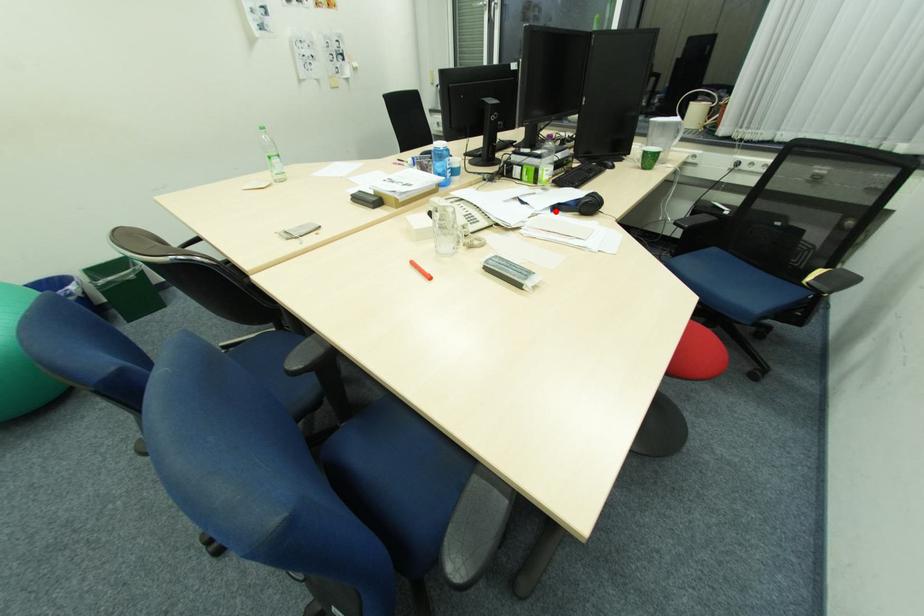
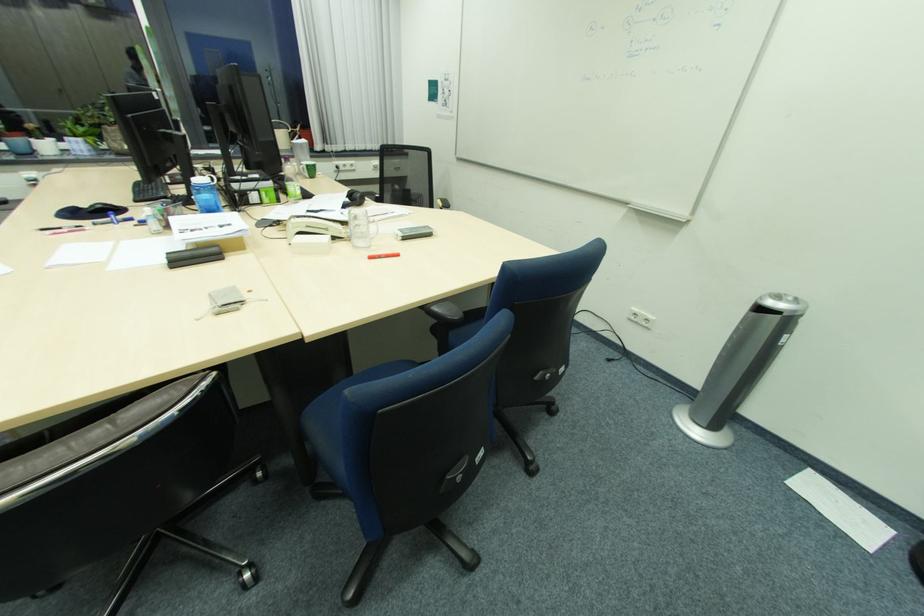
Question: I am providing you with two images of the same scene from different viewpoints. Image1 has a red point marked. In image2, the corresponding 3D location appears at what relative position? Reply with the corresponding letter.

Choices:
 (A) Closer
 (B) Farther

Answer: (B)